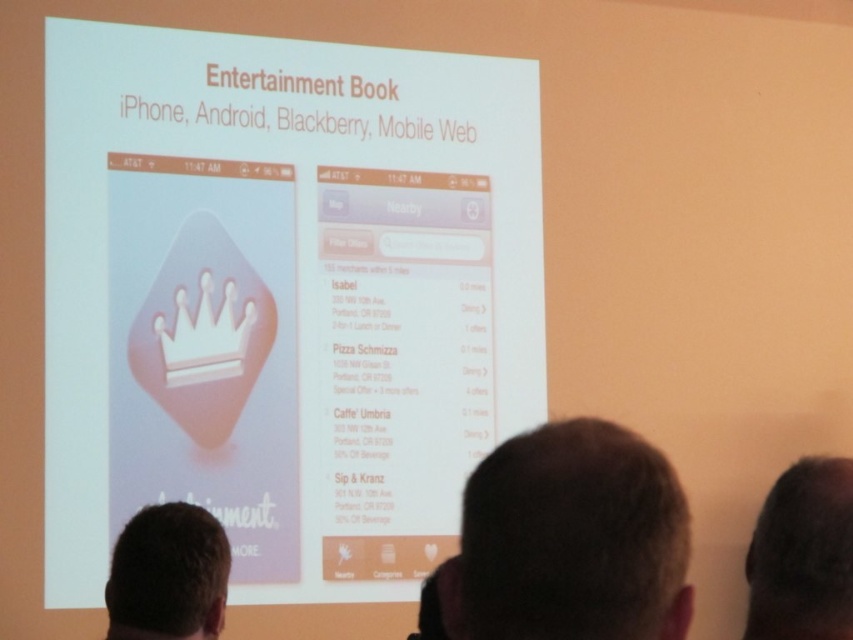
From the picture: You are standing behind the three individuals looking at the presentation slide. Where is the white glossy screen at center positioned relative to the slide?

The white glossy screen at center is positioned at point 0.467 along the horizontal axis and 0.333 along the vertical axis on the slide.

You are standing at the back of the room looking at the presentation slide. There are two points marked on the slide at coordinates point (775, 579) and point (161, 579). Which point is closer to you?

Point (775, 579) is closer to the camera than point (161, 579), so it is closer to you as you are standing at the back of the room.

Consider the image. You are standing at the back of the room and want to move closer to the screen. There are two people with dark brown hair at lower center and brown hair at lower left blocking your path. Which person do you need to go around first to reach the screen?

You need to go around the brown hair at lower left first because the dark brown hair at lower center is 1.26 meters away from them, meaning the brown hair at lower left is closer to you.